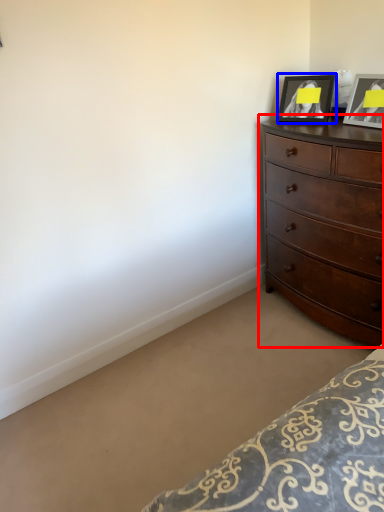
Question: Among these objects, which one is farthest to the camera, chest of drawers (highlighted by a red box) or picture frame (highlighted by a blue box)?

Choices:
 (A) chest of drawers
 (B) picture frame

Answer: (B)